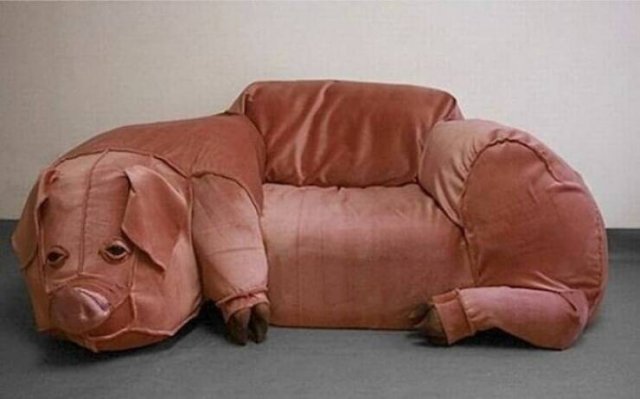
This screenshot has height=399, width=640. What are the coordinates of `seat` in the screenshot? It's located at (351, 217).